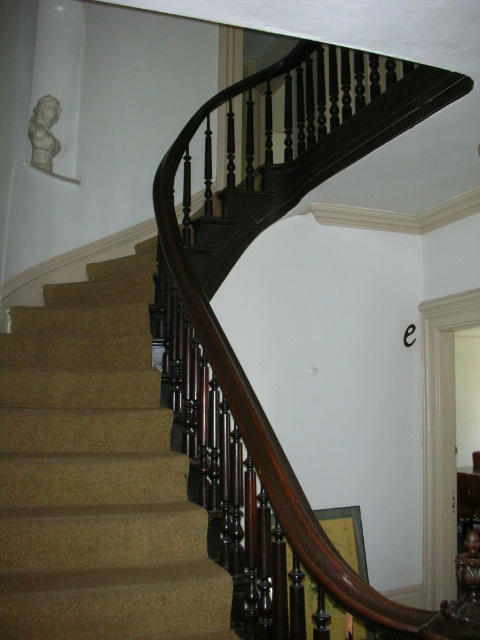
You are a painter holding a 1.2 meter wide canvas. You want to place it horizontally between the dark wood baluster at center and the carpeted stairs at center. Will the canvas fit without overlapping either object?

The dark wood baluster at center has a larger width than the carpeted stairs at center. Since the canvas is 1.2 meters wide, it depends on the combined width of both objects. However, the description only states the baluster is wider, not the total space between them. Without knowing the exact distance between the baluster and the stairs, we cannot confirm if the canvas will fit.

You are a delivery person holding a large package that measures 1.8 meters in length. You need to walk up the carpeted stairs at center while carrying it. Considering your height and the package, will you have enough vertical clearance to ascend the stairs without hitting your head or the package?

The distance between the carpeted stairs at center and the viewer is 1.91 meters. Since the package is 1.8 meters long, there should be sufficient vertical clearance as the space allows for 1.91 meters, which is slightly more than the package length. However, this assumes the ceiling height isn

You are a painter standing on the carpeted stairs at center, looking upward. Can you see the dark wood baluster at center from your current position?

Yes, the dark wood baluster at center is located above the carpeted stairs at center, so you can see it from your position on the stairs.